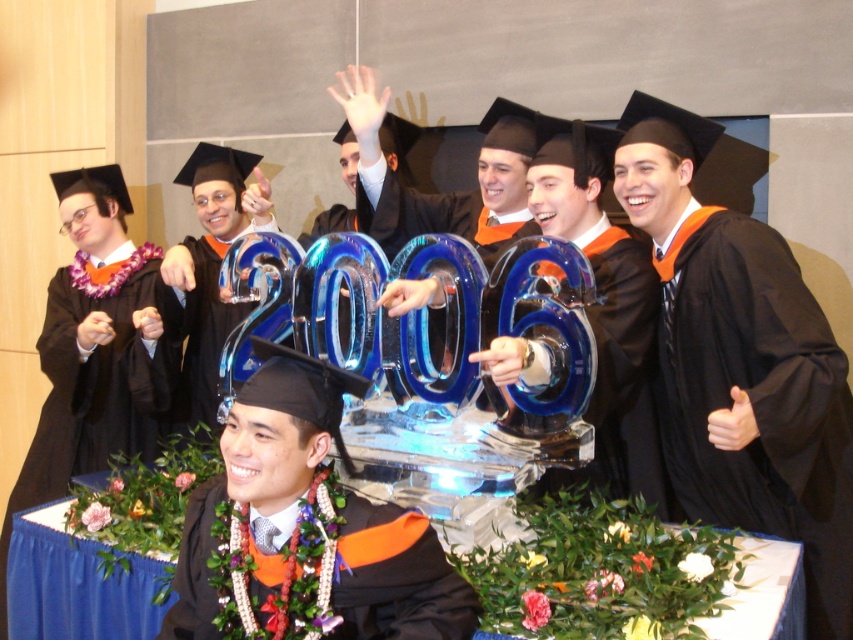
In the scene shown: You are a photographer at the graduation ceremony. You need to capture a photo that includes both the matte black graduation gown at center and the matte black graduation gown at lower center. Which gown should you position lower in the frame to ensure both are visible?

To ensure both the matte black graduation gown at center and the matte black graduation gown at lower center are visible in the photo, position the matte black graduation gown at lower center lower in the frame since it is already positioned below the matte black graduation gown at center.

You are a photographer at the graduation ceremony. You want to capture a photo where both the black matte gown at center and the matte black graduation gown at center are clearly visible. Which gown should you adjust to ensure both are visible in the photo?

The matte black graduation gown at center is behind the black matte gown at center, so you should move the matte black graduation gown at center forward to ensure both are visible in the photo.

You are a photographer at the graduation ceremony. You want to take a photo of the black matte graduation robe at right. Where should you position your camera to capture it?

The black matte graduation robe at right is located at point 0.623 on the x axis and 0.889 on the y axis. Position your camera accordingly to capture it.